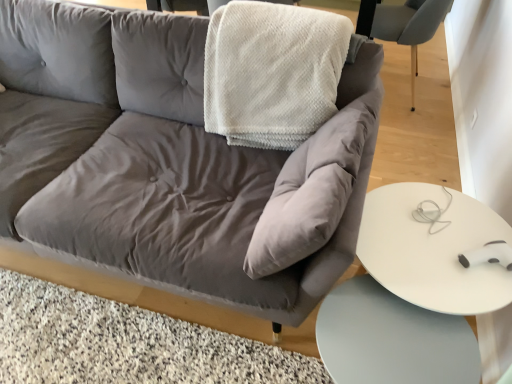
Where is `empty space that is ontop of white glossy table at lower right, the second table in the top-to-bottom sequence (from a real-world perspective)`? The image size is (512, 384). empty space that is ontop of white glossy table at lower right, the second table in the top-to-bottom sequence (from a real-world perspective) is located at coordinates [397, 346].